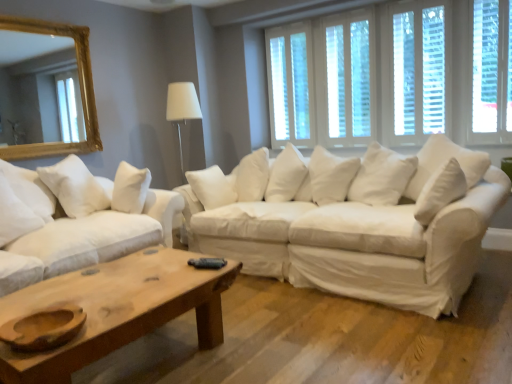
What is the approximate height of white wooden blinds at upper right, arranged as the second window when viewed from the right?

The height of white wooden blinds at upper right, arranged as the second window when viewed from the right, is 4.12 feet.

The height and width of the screenshot is (384, 512). What do you see at coordinates (290, 84) in the screenshot?
I see `white wood window at upper center, which is the first window from left to right` at bounding box center [290, 84].

Describe the element at coordinates (355, 228) in the screenshot. I see `white fabric couch at center, arranged as the first studio couch when viewed from the right` at that location.

Measure the distance between gold-framed mirror at upper left and camera.

A distance of 3.14 meters exists between gold-framed mirror at upper left and camera.

You are a GUI agent. You are given a task and a screenshot of the screen. Output one action in this format:
    pyautogui.click(x=<x>, y=<y>)
    Task: Click on the white wood window at upper right, the first window in the right-to-left sequence
    The height and width of the screenshot is (384, 512).
    Given the screenshot: What is the action you would take?
    pyautogui.click(x=492, y=71)

Is the surface of gold-framed mirror at upper left in direct contact with white fabric couch at center, arranged as the first studio couch when viewed from the right?

They are not placed beside each other.

Relative to white fabric couch at center, marked as the 2th studio couch in a left-to-right arrangement, is gold-framed mirror at upper left in front or behind?

gold-framed mirror at upper left is positioned farther from the viewer than white fabric couch at center, marked as the 2th studio couch in a left-to-right arrangement.

From a real-world perspective, which object stands above the other?

In real-world perspective, gold-framed mirror at upper left is above.

Can you confirm if gold-framed mirror at upper left is positioned to the left of white fabric couch at center, arranged as the first studio couch when viewed from the right?

Correct, you'll find gold-framed mirror at upper left to the left of white fabric couch at center, arranged as the first studio couch when viewed from the right.

Considering the positions of objects wooden coffee table at lower center and gold-framed mirror at upper left in the image provided, who is behind, wooden coffee table at lower center or gold-framed mirror at upper left?

gold-framed mirror at upper left is further from the camera.

Which of these two, wooden coffee table at lower center or gold-framed mirror at upper left, stands taller?

gold-framed mirror at upper left.

Looking at this image, is wooden coffee table at lower center located outside gold-framed mirror at upper left?

Yes.

Can you tell me how much wooden coffee table at lower center and gold-framed mirror at upper left differ in facing direction?

0.00017 degrees separate the facing orientations of wooden coffee table at lower center and gold-framed mirror at upper left.

Who is more distant, white wood window at upper right, the first window in the right-to-left sequence, or white wood window at upper center, the fourth window when ordered from right to left?

white wood window at upper center, the fourth window when ordered from right to left, is behind.

How many degrees apart are the facing directions of white wood window at upper right, the first window in the right-to-left sequence, and white wood window at upper center, the fourth window when ordered from right to left?

They differ by 0.845 degrees in their facing directions.

Which object is positioned more to the right, white wood window at upper right, the first window in the right-to-left sequence, or white wood window at upper center, which is the first window from left to right?

Positioned to the right is white wood window at upper right, the first window in the right-to-left sequence.

From a real-world perspective, does white wooden blinds at upper right, arranged as the second window when viewed from the right, stand above wooden coffee table at lower center?

Yes, from a real-world perspective, white wooden blinds at upper right, arranged as the second window when viewed from the right, is over wooden coffee table at lower center

Is white wooden blinds at upper right, the 3th window from the left, not inside wooden coffee table at lower center?

Indeed, white wooden blinds at upper right, the 3th window from the left, is completely outside wooden coffee table at lower center.

Is point (441, 129) positioned after point (159, 314)?

Yes, it is.

Locate an element on the screen. window that is the 2nd one when counting upward from the wooden coffee table at lower center (from the image's perspective) is located at coordinates (419, 71).

From the image's perspective, which is above, white wood window at upper center, positioned as the 3th window in right-to-left order, or white wood window at upper center, the fourth window when ordered from right to left?

white wood window at upper center, the fourth window when ordered from right to left, is shown above in the image.

What's the angular difference between white wood window at upper center, positioned as the 3th window in right-to-left order, and white wood window at upper center, the fourth window when ordered from right to left,'s facing directions?

0.00575 degrees separate the facing orientations of white wood window at upper center, positioned as the 3th window in right-to-left order, and white wood window at upper center, the fourth window when ordered from right to left.

Does white wood window at upper center, positioned as the 3th window in right-to-left order, turn towards white wood window at upper center, the fourth window when ordered from right to left?

No, white wood window at upper center, positioned as the 3th window in right-to-left order, is not oriented towards white wood window at upper center, the fourth window when ordered from right to left.

Considering their positions, is white wood window at upper center, positioned as the 3th window in right-to-left order, located in front of or behind white wood window at upper center, the fourth window when ordered from right to left?

In the image, white wood window at upper center, positioned as the 3th window in right-to-left order, appears in front of white wood window at upper center, the fourth window when ordered from right to left.

What's the angular difference between white wood window at upper right, the first window in the right-to-left sequence, and gold-framed mirror at upper left's facing directions?

The angle between the facing direction of white wood window at upper right, the first window in the right-to-left sequence, and the facing direction of gold-framed mirror at upper left is 90 degrees.

In the scene shown: From the image's perspective, is white wood window at upper right, the first window in the right-to-left sequence, above or below gold-framed mirror at upper left?

white wood window at upper right, the first window in the right-to-left sequence, is above gold-framed mirror at upper left.

Can you confirm if white wood window at upper right, positioned as the fourth window in left-to-right order, is positioned to the left of gold-framed mirror at upper left?

No, white wood window at upper right, positioned as the fourth window in left-to-right order, is not to the left of gold-framed mirror at upper left.

Looking at this image, is white wood window at upper right, positioned as the fourth window in left-to-right order, to the right of wooden coffee table at lower center from the viewer's perspective?

Correct, you'll find white wood window at upper right, positioned as the fourth window in left-to-right order, to the right of wooden coffee table at lower center.

Is wooden coffee table at lower center completely or partially inside white wood window at upper right, positioned as the fourth window in left-to-right order?

No, wooden coffee table at lower center is not surrounded by white wood window at upper right, positioned as the fourth window in left-to-right order.

Which window is the 1st one when counting from the back of the wooden coffee table at lower center? Please provide its 2D coordinates.

[(492, 71)]

From a real-world perspective, is white wood window at upper right, the first window in the right-to-left sequence, positioned under wooden coffee table at lower center based on gravity?

No, from a real-world perspective, white wood window at upper right, the first window in the right-to-left sequence, is not beneath wooden coffee table at lower center.

Find the location of a particular element. The image size is (512, 384). mirror lying above the white fabric couch at center, arranged as the first studio couch when viewed from the right (from the image's perspective) is located at coordinates (80, 89).

Locate an element on the screen. coffee table below the gold-framed mirror at upper left (from a real-world perspective) is located at coordinates (117, 309).

When comparing their distances from white wooden blinds at upper right, arranged as the second window when viewed from the right, does white wood window at upper center, the fourth window when ordered from right to left, or white fabric couch at center, marked as the 2th studio couch in a left-to-right arrangement, seem closer?

white wood window at upper center, the fourth window when ordered from right to left.

Looking at the image, which one is located closer to white wood window at upper center, the fourth window when ordered from right to left, gold-framed mirror at upper left or white fabric couch at center, marked as the 2th studio couch in a left-to-right arrangement?

white fabric couch at center, marked as the 2th studio couch in a left-to-right arrangement, lies closer to white wood window at upper center, the fourth window when ordered from right to left, than the other object.

Looking at the image, which one is located closer to white soft pillow at left, gold-framed mirror at upper left or white wood window at upper right, positioned as the fourth window in left-to-right order?

gold-framed mirror at upper left lies closer to white soft pillow at left than the other object.

Which object lies nearer to the anchor point white wooden blinds at upper right, arranged as the second window when viewed from the right, white soft pillow at left or white wood window at upper right, the first window in the right-to-left sequence?

white wood window at upper right, the first window in the right-to-left sequence, lies closer to white wooden blinds at upper right, arranged as the second window when viewed from the right, than the other object.

Which object lies nearer to the anchor point white wood window at upper right, the first window in the right-to-left sequence, white cotton couch at center, positioned as the 2th studio couch in right-to-left order, or white wood window at upper center, which is the first window from left to right?

Based on the image, white wood window at upper center, which is the first window from left to right, appears to be nearer to white wood window at upper right, the first window in the right-to-left sequence.

Based on their spatial positions, is white soft pillow at left or white wood window at upper center, the fourth window when ordered from right to left, further from white wood window at upper right, positioned as the fourth window in left-to-right order?

white soft pillow at left is further to white wood window at upper right, positioned as the fourth window in left-to-right order.

When comparing their distances from gold-framed mirror at upper left, does white wood window at upper right, the first window in the right-to-left sequence, or white wooden blinds at upper right, arranged as the second window when viewed from the right, seem further?

Among the two, white wood window at upper right, the first window in the right-to-left sequence, is located further to gold-framed mirror at upper left.

Based on their spatial positions, is white wood window at upper center, positioned as the 2th window in left-to-right order, or white wood window at upper center, the fourth window when ordered from right to left, further from wooden coffee table at lower center?

white wood window at upper center, the fourth window when ordered from right to left, is further to wooden coffee table at lower center.

I want to click on studio couch between white cotton couch at center, marked as the 1th studio couch in a left-to-right arrangement, and white wooden blinds at upper right, arranged as the second window when viewed from the right, so click(x=355, y=228).

Image resolution: width=512 pixels, height=384 pixels. Find the location of `pillow located between white fabric couch at center, arranged as the first studio couch when viewed from the right, and white wood window at upper center, which is the first window from left to right, in the depth direction`. pillow located between white fabric couch at center, arranged as the first studio couch when viewed from the right, and white wood window at upper center, which is the first window from left to right, in the depth direction is located at coordinates (130, 188).

Where is `pillow located between gold-framed mirror at upper left and white wood window at upper center, which is the first window from left to right, in the left-right direction`? The height and width of the screenshot is (384, 512). pillow located between gold-framed mirror at upper left and white wood window at upper center, which is the first window from left to right, in the left-right direction is located at coordinates (130, 188).

Identify the location of pillow situated between white cotton couch at center, marked as the 1th studio couch in a left-to-right arrangement, and white wood window at upper center, positioned as the 3th window in right-to-left order, from left to right. (130, 188).